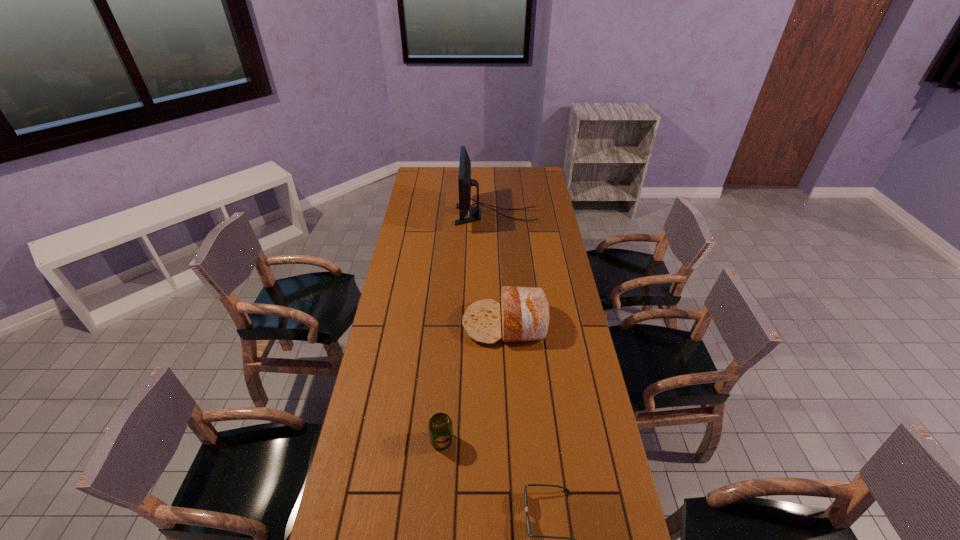
Where is `computer monitor`? The image size is (960, 540). computer monitor is located at coordinates (465, 182).

The image size is (960, 540). Identify the location of the tallest object. (465, 182).

I want to click on bread, so click(525, 312).

Where is `the third nearest object`? the third nearest object is located at coordinates (525, 312).

The height and width of the screenshot is (540, 960). What are the coordinates of `the second shortest object` in the screenshot? It's located at [x=440, y=425].

Locate an element on the screen. the third farthest object is located at coordinates (440, 425).

I want to click on vacant area located 0.150m on the screen side of the tallest object, so click(427, 215).

Where is `free space located on the screen side of the tallest object`? Image resolution: width=960 pixels, height=540 pixels. free space located on the screen side of the tallest object is located at coordinates (427, 215).

Locate an element on the screen. free region located on the screen side of the tallest object is located at coordinates (433, 215).

Where is `free space located at the sliced end of the second tallest object`? This screenshot has width=960, height=540. free space located at the sliced end of the second tallest object is located at coordinates (421, 324).